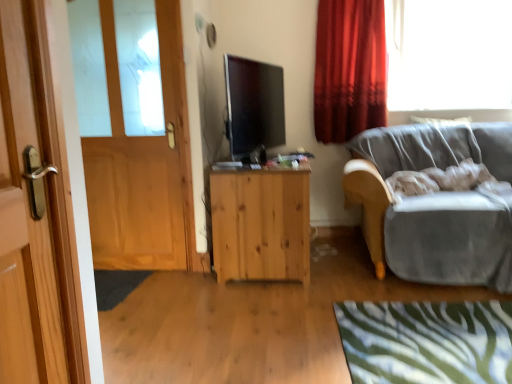
You are a GUI agent. You are given a task and a screenshot of the screen. Output one action in this format:
    pyautogui.click(x=<x>, y=<y>)
    Task: Click on the free space in front of natural wood cabinet at center
    
    Given the screenshot: What is the action you would take?
    pyautogui.click(x=242, y=304)